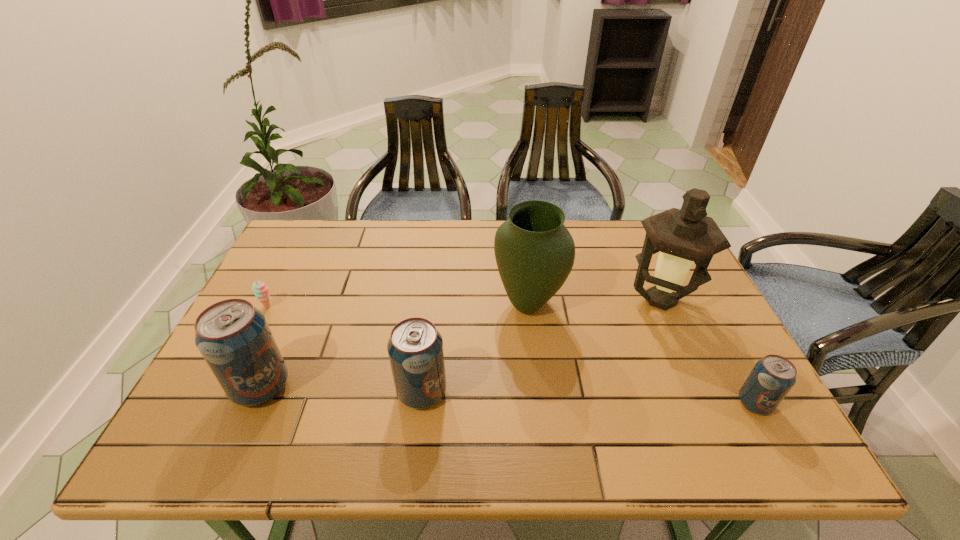
This screenshot has width=960, height=540. In order to click on the leftmost pop soda in this screenshot , I will do `click(234, 338)`.

You are a GUI agent. You are given a task and a screenshot of the screen. Output one action in this format:
    pyautogui.click(x=<x>, y=<y>)
    Task: Click on the fourth tallest object
    The image size is (960, 540).
    Given the screenshot: What is the action you would take?
    pyautogui.click(x=415, y=348)

Identify the location of the second tallest pop soda. (415, 348).

The width and height of the screenshot is (960, 540). Identify the location of the rightmost pop soda. (772, 377).

Identify the location of the second shortest object. (772, 377).

You are a GUI agent. You are given a task and a screenshot of the screen. Output one action in this format:
    pyautogui.click(x=<x>, y=<y>)
    Task: Click on the second tallest object
    This screenshot has height=540, width=960.
    Given the screenshot: What is the action you would take?
    pyautogui.click(x=534, y=251)

Locate an element on the screen. the third object from right to left is located at coordinates (534, 251).

This screenshot has width=960, height=540. I want to click on the shortest object, so click(x=260, y=290).

Find the location of a particular element. oil lamp is located at coordinates (682, 236).

Identify the location of free spot located on the right of the leftmost pop soda. (320, 387).